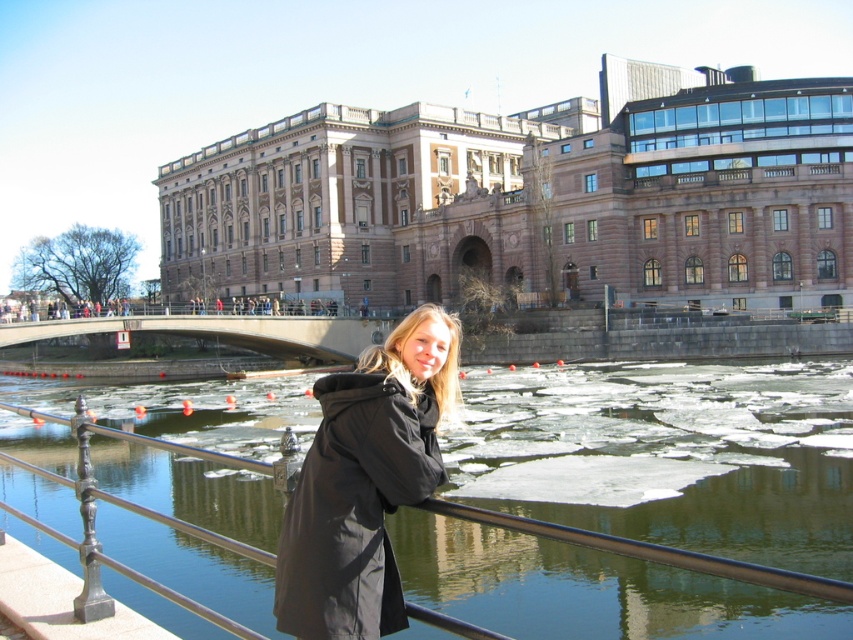
This screenshot has width=853, height=640. Describe the element at coordinates (669, 454) in the screenshot. I see `clear water at center` at that location.

What do you see at coordinates (669, 454) in the screenshot? I see `clear water at center` at bounding box center [669, 454].

This screenshot has width=853, height=640. I want to click on clear water at center, so click(669, 454).

Measure the distance from clear water at center to brown stone building at center.

clear water at center and brown stone building at center are 35.16 meters apart.

Which is above, clear water at center or brown stone building at center?

brown stone building at center is higher up.

Identify the location of clear water at center. (669, 454).

You are a GUI agent. You are given a task and a screenshot of the screen. Output one action in this format:
    pyautogui.click(x=<x>, y=<y>)
    Task: Click on the clear water at center
    Image resolution: width=853 pixels, height=640 pixels.
    Given the screenshot: What is the action you would take?
    pyautogui.click(x=669, y=454)

Who is higher up, clear water at center or black matte coat at center?

Positioned higher is clear water at center.

Which is behind, point (814, 492) or point (456, 403)?

The point (814, 492) is more distant.

Measure the distance between point (672, 612) and camera.

They are 31.75 meters apart.

The width and height of the screenshot is (853, 640). What are the coordinates of `clear water at center` in the screenshot? It's located at (669, 454).